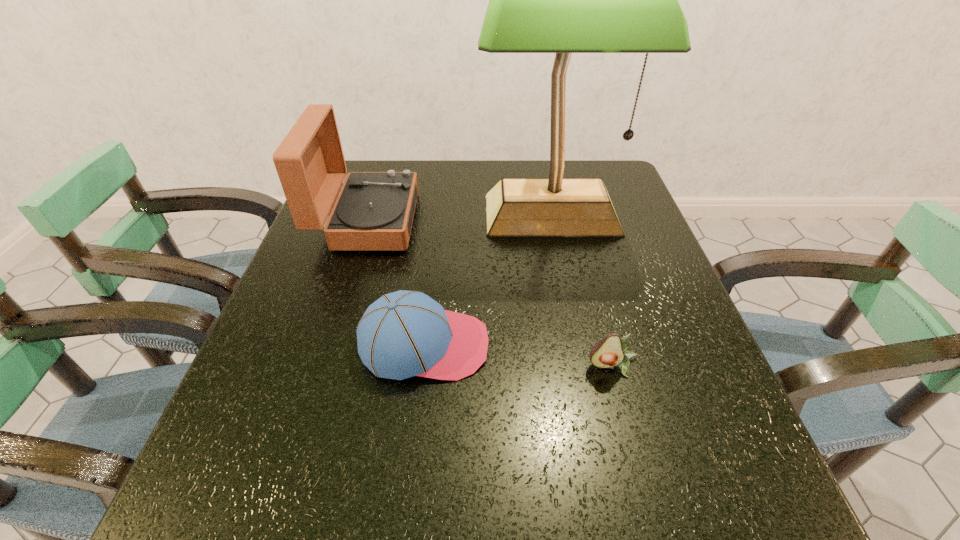
I want to click on object present at the left edge, so [x=374, y=210].

Find the location of a particular element. table lamp that is at the right edge is located at coordinates (563, 0).

You are a GUI agent. You are given a task and a screenshot of the screen. Output one action in this format:
    pyautogui.click(x=<x>, y=<y>)
    Task: Click on the avocado that is at the right edge
    
    Given the screenshot: What is the action you would take?
    pyautogui.click(x=610, y=351)

Image resolution: width=960 pixels, height=540 pixels. I want to click on object that is at the far left corner, so click(x=374, y=210).

Identify the location of object at the far right corner. This screenshot has width=960, height=540. (563, 0).

I want to click on vacant area at the far edge of the desktop, so click(474, 176).

In order to click on vacant area at the near edge in this screenshot , I will do `click(329, 476)`.

I want to click on blank space at the left edge of the desktop, so click(x=311, y=332).

The width and height of the screenshot is (960, 540). I want to click on vacant space at the right edge of the desktop, so click(x=652, y=234).

In the image, there is a desktop. Identify the location of free region at the far right corner. (622, 177).